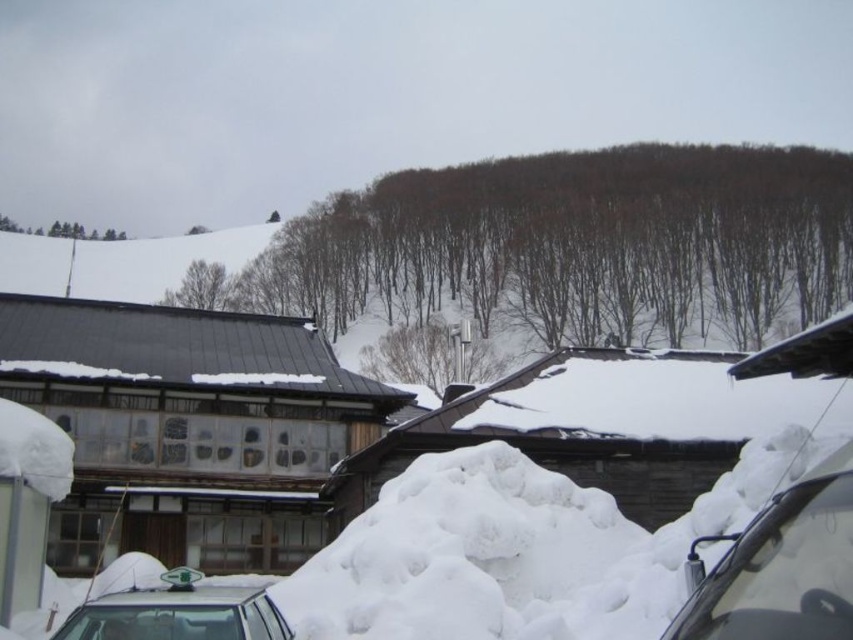
You are driving a car with a clear glass windshield at lower right and notice a green leafy tree at upper left in your view. Can your windshield accommodate the width of the tree if you need to maneuver around it?

The clear glass windshield at lower right has a smaller width than the green leafy tree at upper left, so it cannot fully accommodate the tree width. You may need to adjust your driving path to avoid collision.

You are standing at the center of the image and want to locate the smooth gray pole at center. According to the coordinates provided, where would you find it relative to your current position?

The smooth gray pole at center is located at coordinates point (431,355), which is slightly to the right and slightly below your current position at the center of the image.